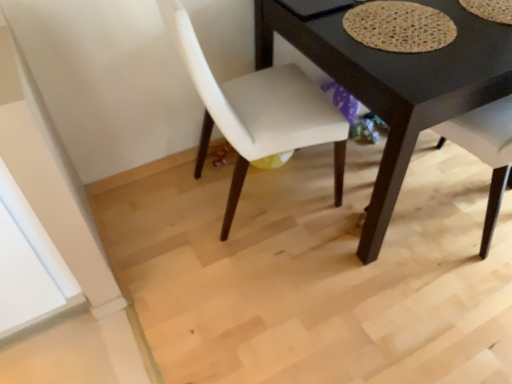
Question: Considering the relative sizes of textured beige mat at upper right and white fabric chair at center in the image provided, is textured beige mat at upper right bigger than white fabric chair at center?

Choices:
 (A) yes
 (B) no

Answer: (B)

Question: Is textured beige mat at upper right wider than white fabric chair at center?

Choices:
 (A) no
 (B) yes

Answer: (A)

Question: From the image's perspective, is textured beige mat at upper right located above white fabric chair at center?

Choices:
 (A) yes
 (B) no

Answer: (A)

Question: Is textured beige mat at upper right positioned in front of white fabric chair at center?

Choices:
 (A) no
 (B) yes

Answer: (A)

Question: Is textured beige mat at upper right to the right of white fabric chair at center from the viewer's perspective?

Choices:
 (A) no
 (B) yes

Answer: (B)

Question: Are textured beige mat at upper right and white fabric chair at center far apart?

Choices:
 (A) yes
 (B) no

Answer: (B)

Question: Does black matte table at center appear on the left side of textured beige mat at upper right?

Choices:
 (A) yes
 (B) no

Answer: (B)

Question: Is black matte table at center outside textured beige mat at upper right?

Choices:
 (A) no
 (B) yes

Answer: (B)

Question: Can you see black matte table at center touching textured beige mat at upper right?

Choices:
 (A) yes
 (B) no

Answer: (B)

Question: Does black matte table at center have a larger size compared to textured beige mat at upper right?

Choices:
 (A) no
 (B) yes

Answer: (B)

Question: Is textured beige mat at upper right surrounded by black matte table at center?

Choices:
 (A) yes
 (B) no

Answer: (A)

Question: Can you confirm if black matte table at center is positioned to the right of textured beige mat at upper right?

Choices:
 (A) no
 (B) yes

Answer: (B)

Question: From the image's perspective, is white fabric chair at center below textured beige mat at upper right?

Choices:
 (A) no
 (B) yes

Answer: (B)